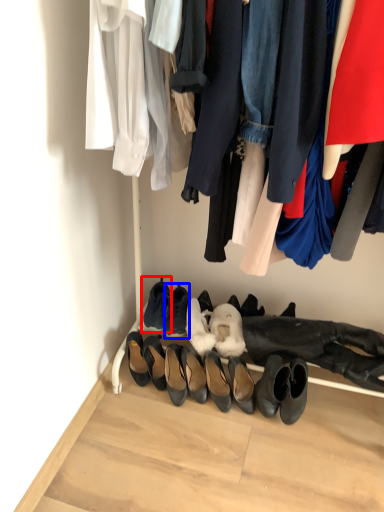
Question: Which object appears closest to the camera in this image, footwear (highlighted by a red box) or footwear (highlighted by a blue box)?

Choices:
 (A) footwear
 (B) footwear

Answer: (B)